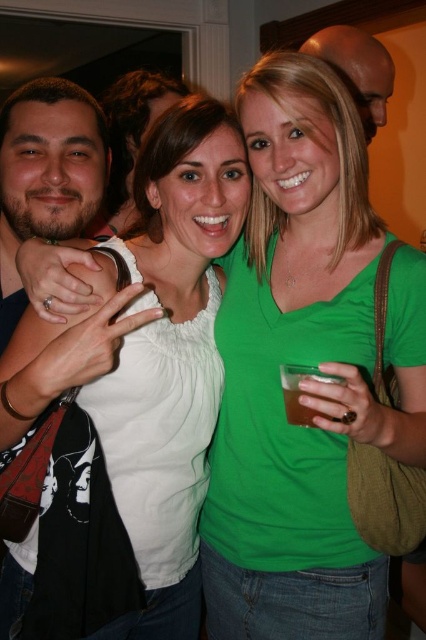
Question: Which object appears farthest from the camera in this image?

Choices:
 (A) translucent amber liquid at hand right
 (B) green matte shirt at center
 (C) bald head at upper center
 (D) white matte shirt at center

Answer: (C)

Question: Which point is farther to the camera?

Choices:
 (A) (181, 168)
 (B) (253, 595)

Answer: (B)

Question: Considering the relative positions of bald head at upper center and translucent amber liquid at hand right in the image provided, where is bald head at upper center located with respect to translucent amber liquid at hand right?

Choices:
 (A) right
 (B) left

Answer: (A)

Question: Is white matte shirt at center smaller than translucent amber liquid at hand right?

Choices:
 (A) yes
 (B) no

Answer: (B)

Question: Considering the real-world distances, which object is farthest from the bald head at upper center?

Choices:
 (A) white matte shirt at center
 (B) green matte shirt at center

Answer: (A)

Question: Is green matte shirt at center above bald head at upper center?

Choices:
 (A) no
 (B) yes

Answer: (A)